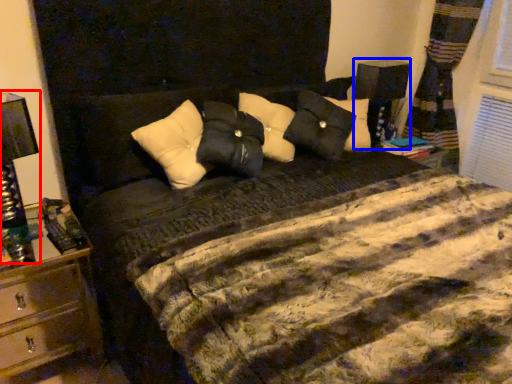
Question: Which object appears farthest to the camera in this image, bedside lamp (highlighted by a red box) or bedside lamp (highlighted by a blue box)?

Choices:
 (A) bedside lamp
 (B) bedside lamp

Answer: (B)